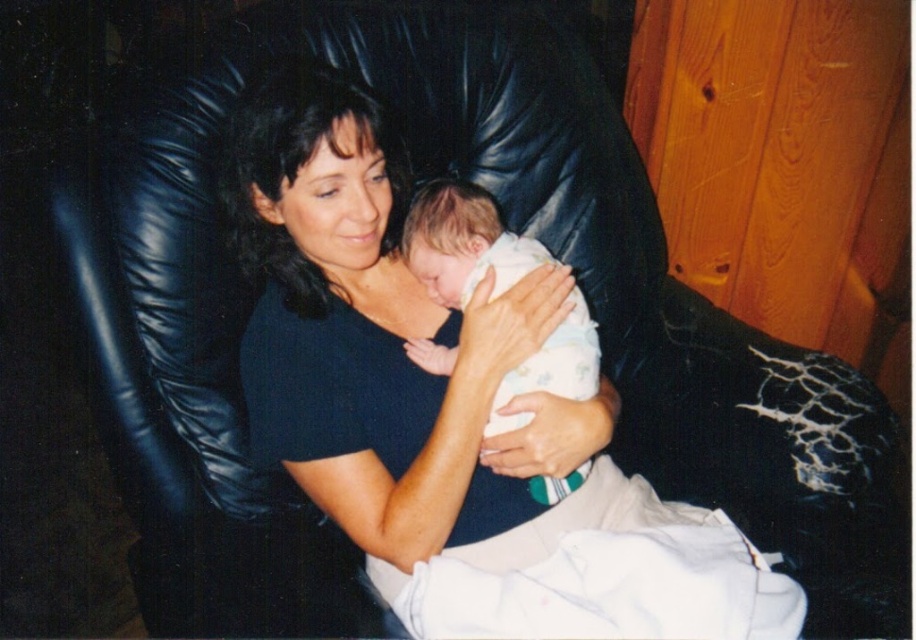
Question: Observing the image, what is the correct spatial positioning of black matte shirt at center in reference to white clothed baby at center?

Choices:
 (A) left
 (B) right

Answer: (A)

Question: Which point is farther to the camera?

Choices:
 (A) white clothed baby at center
 (B) black matte shirt at center

Answer: (A)

Question: Does black matte shirt at center have a greater width compared to white clothed baby at center?

Choices:
 (A) yes
 (B) no

Answer: (A)

Question: Considering the relative positions of black matte shirt at center and white clothed baby at center in the image provided, where is black matte shirt at center located with respect to white clothed baby at center?

Choices:
 (A) above
 (B) below

Answer: (B)

Question: Which point is closer to the camera?

Choices:
 (A) black matte shirt at center
 (B) white clothed baby at center

Answer: (A)

Question: Which point appears closest to the camera in this image?

Choices:
 (A) (700, 630)
 (B) (431, 250)

Answer: (A)